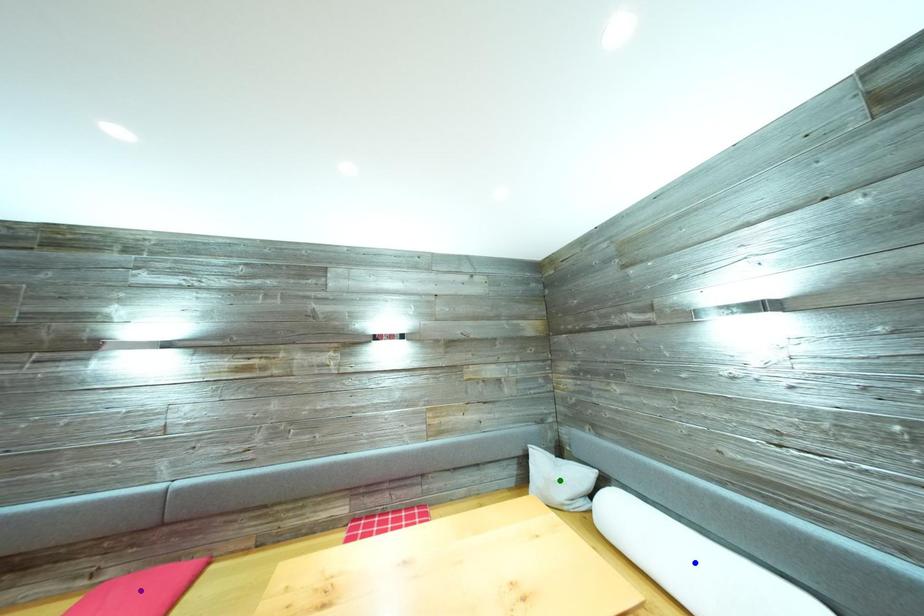
Order these from nearest to farthest:
blue point | purple point | green point

blue point
purple point
green point